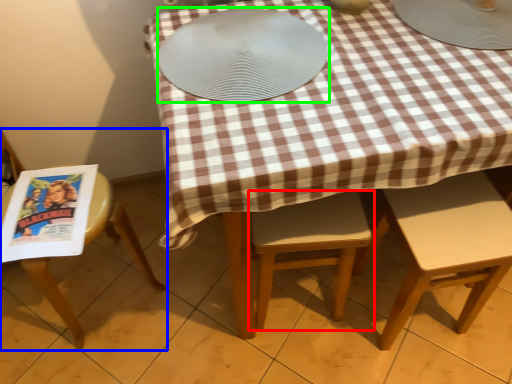
Question: Which object is positioned farthest from chair (highlighted by a red box)? Select from chair (highlighted by a blue box) and platter (highlighted by a green box).

Choices:
 (A) chair
 (B) platter

Answer: (A)